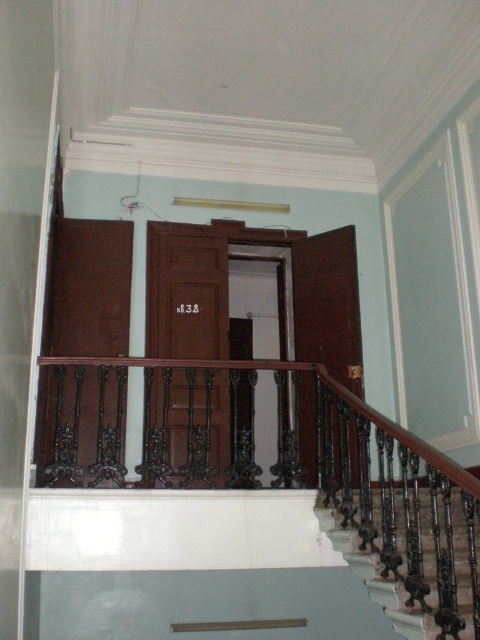
You are standing at the bottom of the staircase and want to take a photo of the two points marked on the wall. Which point, point (468, 492) or point (374, 582), will appear larger in your camera view?

Point (468, 492) is closer to the camera than point (374, 582), so it will appear larger in the camera view.